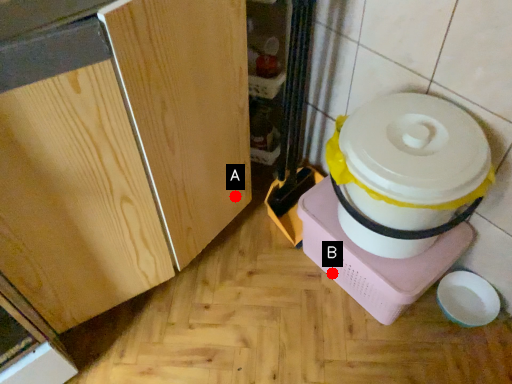
Question: Two points are circled on the image, labeled by A and B beside each circle. Among these points, which one is farthest from the camera?

Choices:
 (A) A is further
 (B) B is further

Answer: (A)